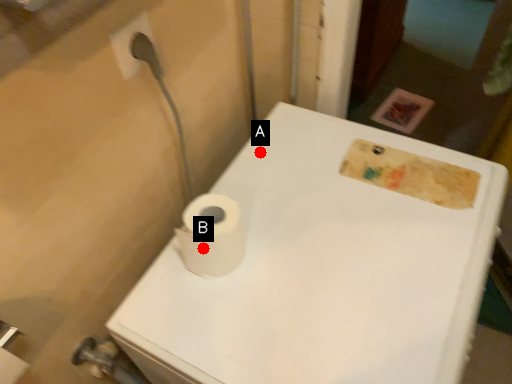
Question: Two points are circled on the image, labeled by A and B beside each circle. Which point is closer to the camera?

Choices:
 (A) A is closer
 (B) B is closer

Answer: (B)